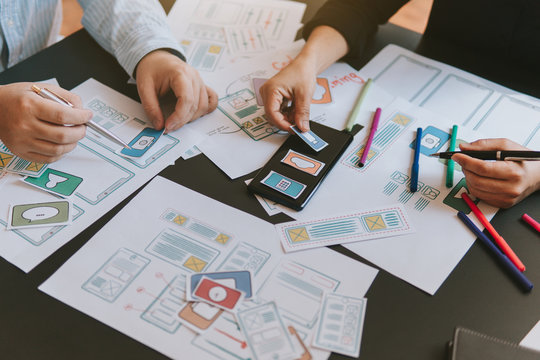
In order to click on black table in this screenshot , I will do pyautogui.click(x=33, y=332).